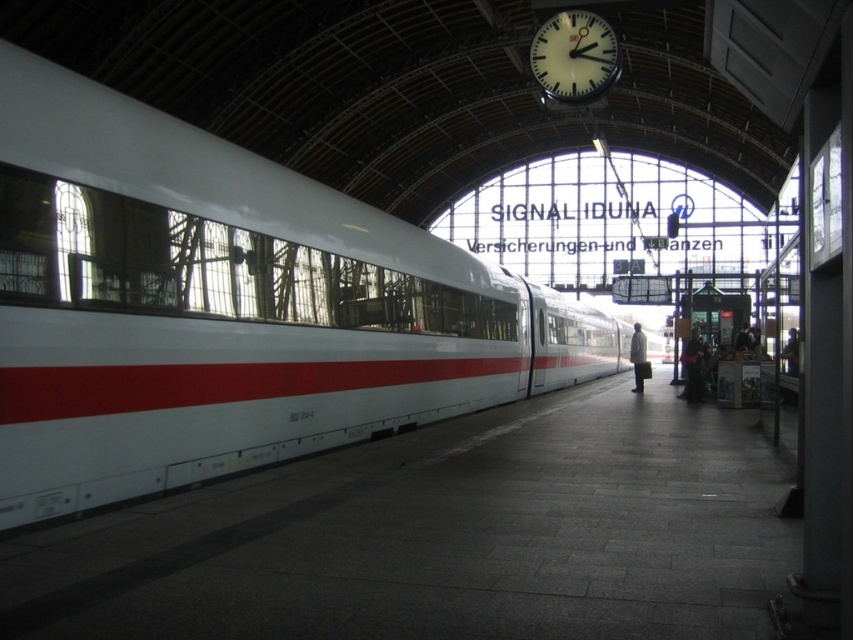
Question: Which of the following is the closest to the observer?

Choices:
 (A) (103, 150)
 (B) (554, 76)
 (C) (682, 356)

Answer: (A)

Question: Considering the real-world distances, which object is closest to the white glossy clock at upper center?

Choices:
 (A) white matte coat at center
 (B) white glossy train at center
 (C) dark blue fabric coat at right

Answer: (B)

Question: Considering the relative positions of dark blue fabric coat at right and smooth skin face at right in the image provided, where is dark blue fabric coat at right located with respect to smooth skin face at right?

Choices:
 (A) below
 (B) above

Answer: (A)

Question: Does white glossy clock at upper center appear over smooth skin face at right?

Choices:
 (A) yes
 (B) no

Answer: (A)

Question: Is white glossy clock at upper center below dark blue fabric coat at right?

Choices:
 (A) yes
 (B) no

Answer: (B)

Question: Which point appears closest to the camera in this image?

Choices:
 (A) (798, 330)
 (B) (683, 353)

Answer: (A)